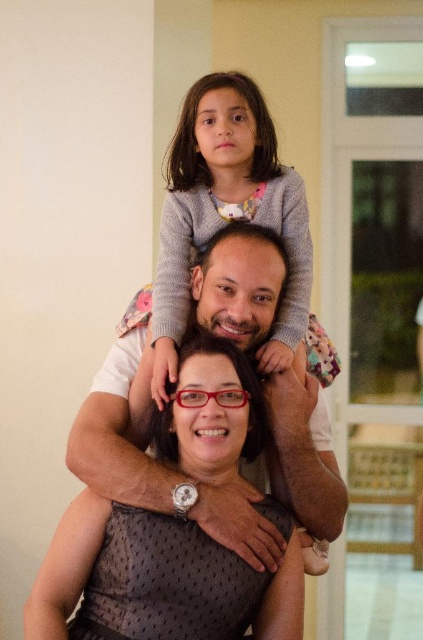
Question: Is matte black dress at center smaller than matte white shirt at center?

Choices:
 (A) no
 (B) yes

Answer: (B)

Question: Which of these objects is positioned farthest from the gray sweater at upper center?

Choices:
 (A) matte black dress at center
 (B) matte white shirt at center

Answer: (A)

Question: Considering the real-world distances, which object is closest to the matte black dress at center?

Choices:
 (A) gray sweater at upper center
 (B) matte white shirt at center

Answer: (B)

Question: Considering the relative positions of matte black dress at center and matte white shirt at center in the image provided, where is matte black dress at center located with respect to matte white shirt at center?

Choices:
 (A) left
 (B) right

Answer: (B)

Question: Observing the image, what is the correct spatial positioning of matte black dress at center in reference to gray sweater at upper center?

Choices:
 (A) left
 (B) right

Answer: (A)

Question: Which object is closer to the camera taking this photo?

Choices:
 (A) gray sweater at upper center
 (B) matte black dress at center

Answer: (B)